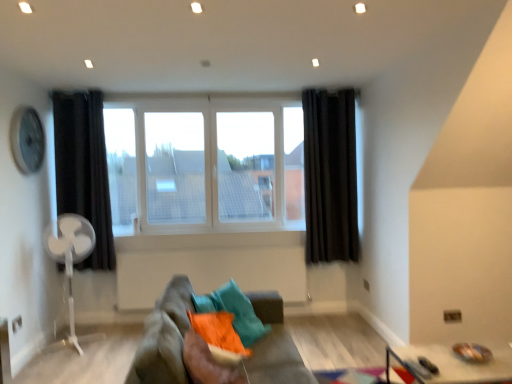
Question: From the image's perspective, is white glass window at center located above or below metallic silver clock at upper left?

Choices:
 (A) above
 (B) below

Answer: (B)

Question: From a real-world perspective, is white glass window at center positioned above or below metallic silver clock at upper left?

Choices:
 (A) below
 (B) above

Answer: (A)

Question: Which object is the farthest from the metallic silver clock at upper left?

Choices:
 (A) white glass window at center
 (B) metallic silver tray at lower right
 (C) textured fabric couch at center
 (D) white plastic fan at left
 (E) black fabric curtain at right, the 2th curtain when ordered from left to right

Answer: (B)

Question: Which object is the farthest from the textured fabric couch at center?

Choices:
 (A) white plastic fan at left
 (B) black fabric curtain at right, the 2th curtain when ordered from left to right
 (C) metallic silver tray at lower right
 (D) metallic silver clock at upper left
 (E) black fabric curtain at left, acting as the first curtain starting from the left

Answer: (B)